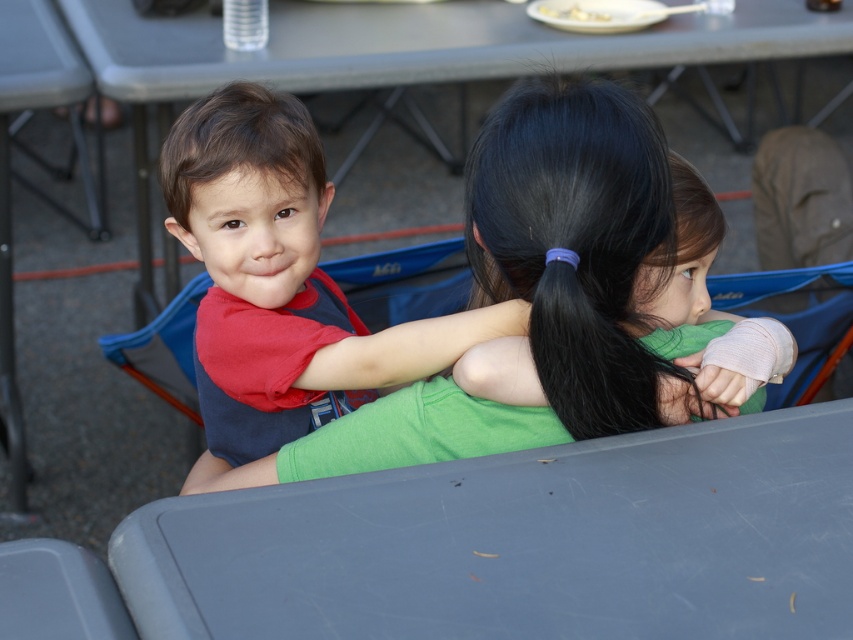
You are a photographer trying to capture a closeup of the matte red shirt at upper left and the black silky hair at upper center. Which object should you zoom in on first to ensure both are in focus?

The matte red shirt at upper left is larger in size than the black silky hair at upper center, so you should zoom in on the matte red shirt at upper left first to ensure both are in focus.

You are a photographer trying to capture a candid shot of the two children and the adult. You notice the matte red shirt at upper left and the black silky hair at upper center. Considering the distance between them, can you estimate whether you can fit both subjects into a single frame without zooming in?

The matte red shirt at upper left and the black silky hair at upper center are 1.60 inches apart. Since the distance between them is relatively small, you can likely fit both subjects into a single frame without needing to zoom in.

You are a photographer trying to capture a closeup shot of the black silky hair at upper center and the brown matte hair at upper left. Which hair should you zoom in on first to ensure it fits entirely within your camera frame?

The black silky hair at upper center is bigger than the brown matte hair at upper left, so you should zoom in on the black silky hair at upper center first to ensure it fits entirely within your camera frame.